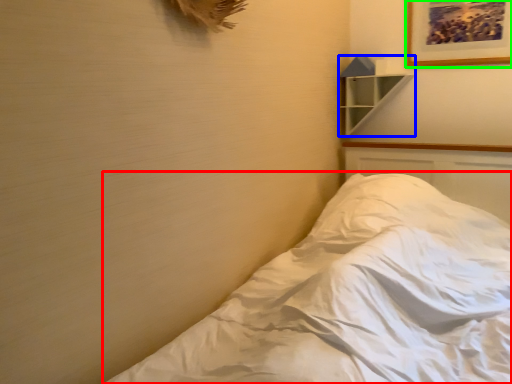
Question: Which object is the farthest from bed (highlighted by a red box)? Choose among these: shelf (highlighted by a blue box) or picture frame (highlighted by a green box).

Choices:
 (A) shelf
 (B) picture frame

Answer: (B)